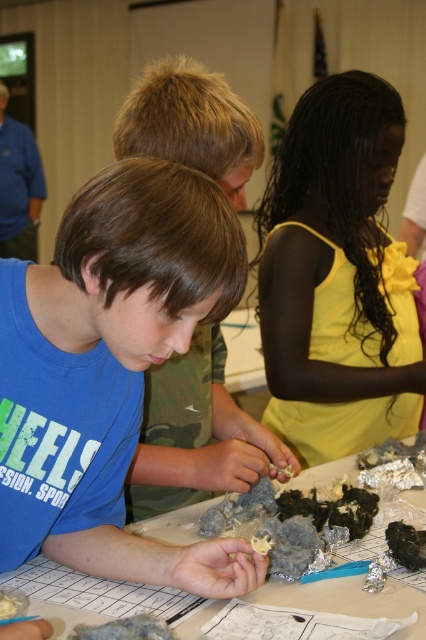
Can you confirm if matte blue shirt at center is wider than white paper at center?

No.

What are the coordinates of `matte blue shirt at center` in the screenshot? It's located at (109, 371).

Is point (183, 336) closer to viewer compared to point (397, 598)?

Yes, it is in front of point (397, 598).

You are a GUI agent. You are given a task and a screenshot of the screen. Output one action in this format:
    pyautogui.click(x=<x>, y=<y>)
    Task: Click on the matte blue shirt at center
    
    Given the screenshot: What is the action you would take?
    pyautogui.click(x=109, y=371)

Does brown matte hair at center have a larger size compared to white paper at center?

Actually, brown matte hair at center might be smaller than white paper at center.

Is brown matte hair at center to the left of white paper at center from the viewer's perspective?

Correct, you'll find brown matte hair at center to the left of white paper at center.

Between point (172, 472) and point (317, 582), which one is positioned in front?

Point (317, 582) is in front.

Locate an element on the screen. This screenshot has width=426, height=640. brown matte hair at center is located at coordinates (196, 435).

Does yellow satin dress at center have a larger size compared to white paper at center?

Yes, yellow satin dress at center is bigger than white paper at center.

Is point (270, 292) behind point (218, 602)?

Yes, point (270, 292) is farther from viewer.

Is point (333, 195) positioned after point (296, 602)?

Yes, point (333, 195) is farther from viewer.

Locate an element on the screen. yellow satin dress at center is located at coordinates (337, 276).